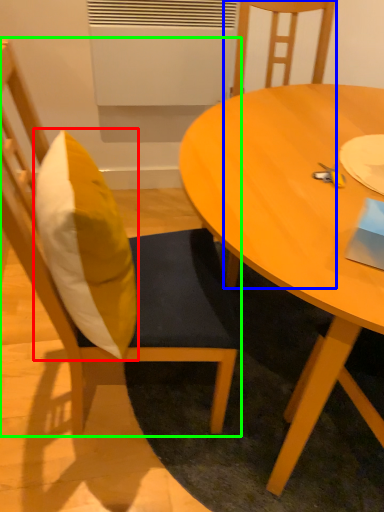
Question: Which is nearer to the pillow (highlighted by a red box)? chair (highlighted by a blue box) or chair (highlighted by a green box).

Choices:
 (A) chair
 (B) chair

Answer: (B)